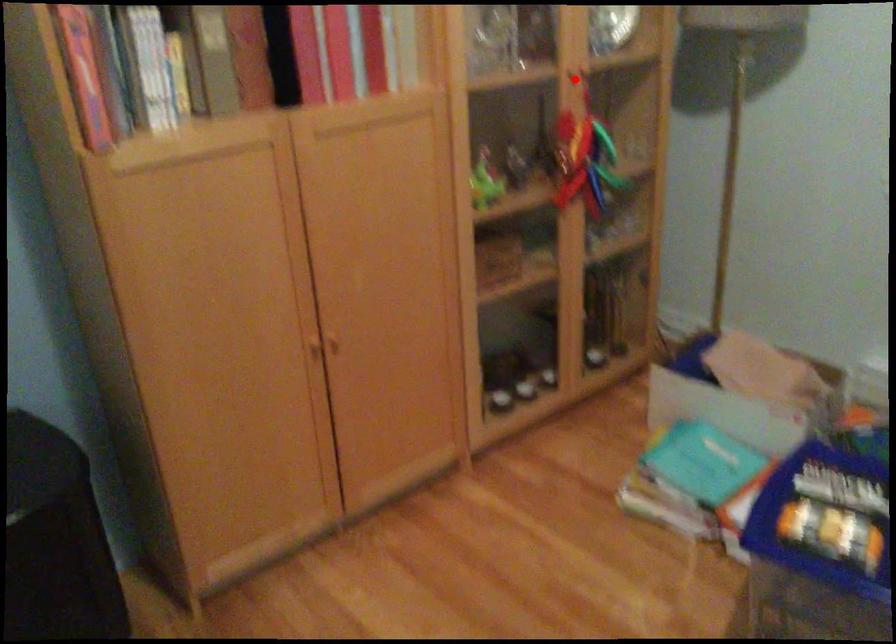
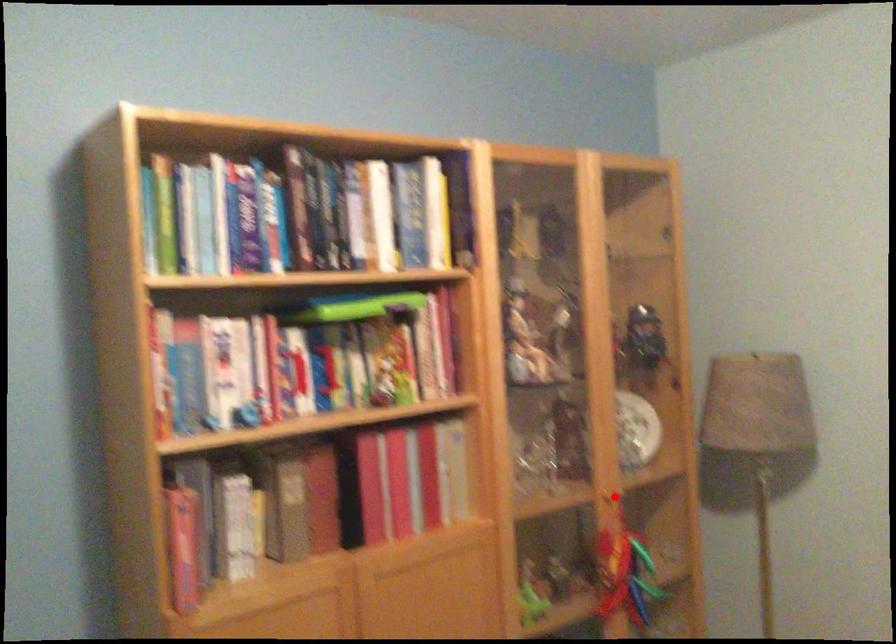
I am providing you with two images of the same scene from different viewpoints. A red point is marked on the first image and another point is marked on the second image. Is the red point in image1 aligned with the point shown in image2?

Yes